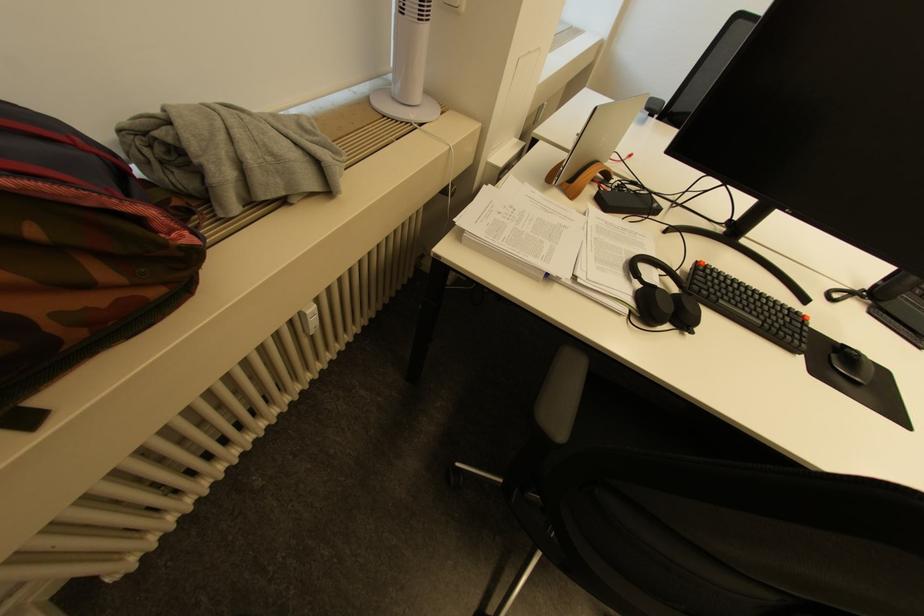
This screenshot has height=616, width=924. Find the location of `black computer mouse`. black computer mouse is located at coordinates (852, 363).